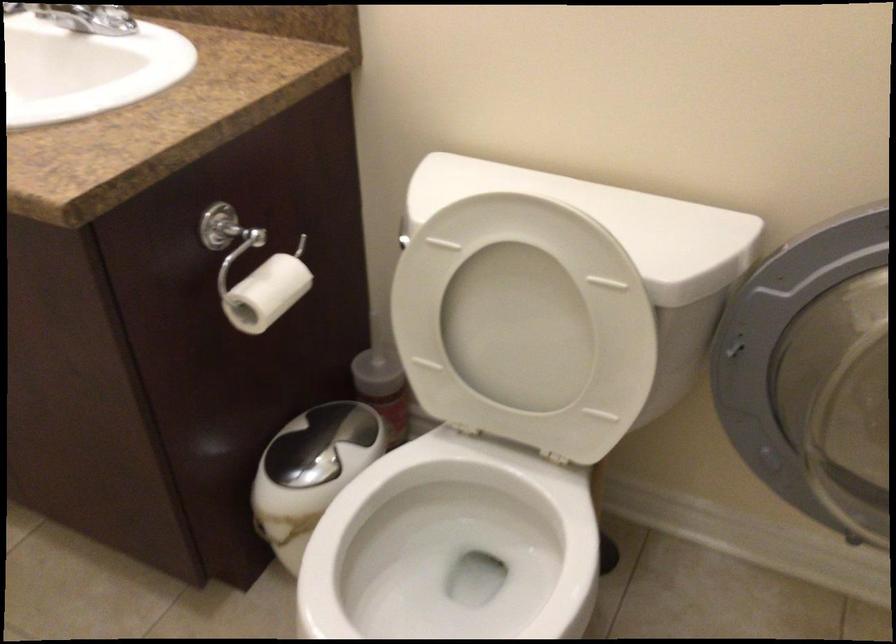
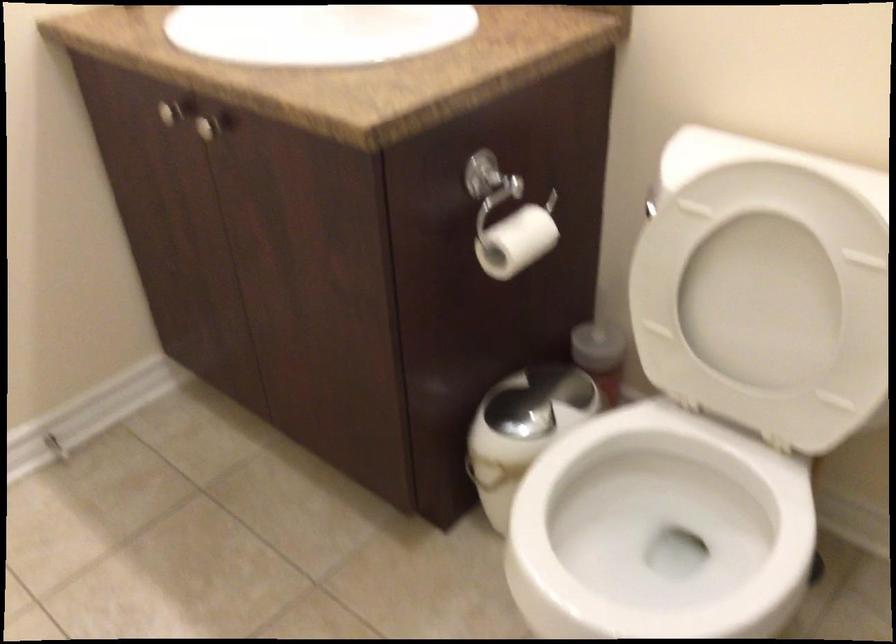
Find the pixel in the second image that matches (316,464) in the first image.

(529, 413)